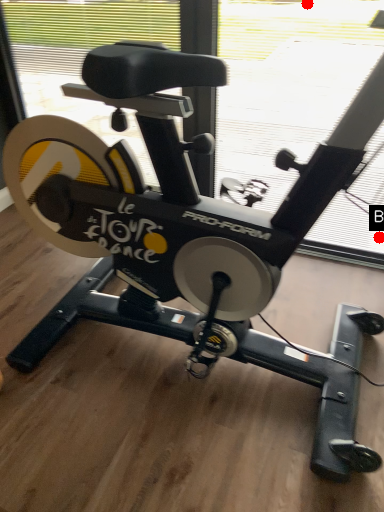
Question: Two points are circled on the image, labeled by A and B beside each circle. Which point is further to the camera?

Choices:
 (A) A is further
 (B) B is further

Answer: (B)